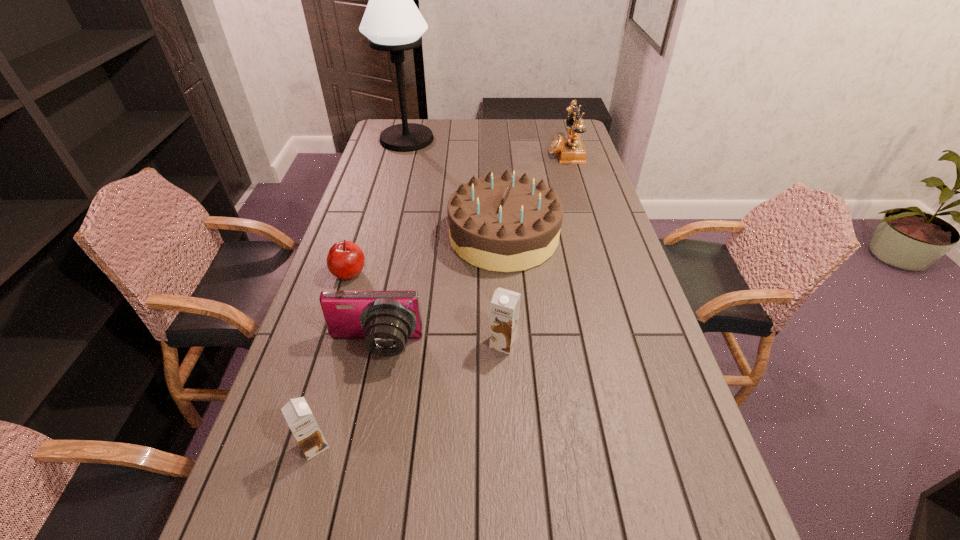
The image size is (960, 540). In order to click on free location located 0.390m on the back of the taller chocolate milk in this screenshot , I will do `click(498, 240)`.

The width and height of the screenshot is (960, 540). I want to click on blank area located on the right of the table lamp, so click(521, 139).

What are the coordinates of `vacant space located on the dial number of the rightmost object` in the screenshot? It's located at (461, 152).

At what (x,y) coordinates should I click in order to perform the action: click on vacant space located on the dial number of the rightmost object. Please return your answer as a coordinate pair (x, y). Looking at the image, I should click on (456, 152).

Find the location of a particular element. vacant space located 0.140m on the dial number of the rightmost object is located at coordinates (516, 152).

Locate an element on the screen. The width and height of the screenshot is (960, 540). free region located 0.240m on the front-facing side of the birthday cake is located at coordinates (375, 237).

You are a GUI agent. You are given a task and a screenshot of the screen. Output one action in this format:
    pyautogui.click(x=<x>, y=<y>)
    Task: Click on the free region located on the front-facing side of the birthday cake
    
    Given the screenshot: What is the action you would take?
    pyautogui.click(x=424, y=237)

Locate an element on the screen. vacant space located 0.270m on the front-facing side of the birthday cake is located at coordinates (367, 237).

Locate an element on the screen. This screenshot has width=960, height=540. vacant space situated 0.140m on the back of the shortest object is located at coordinates (362, 233).

This screenshot has width=960, height=540. What are the coordinates of `vacant region located on the front-facing side of the camera` in the screenshot? It's located at [345, 484].